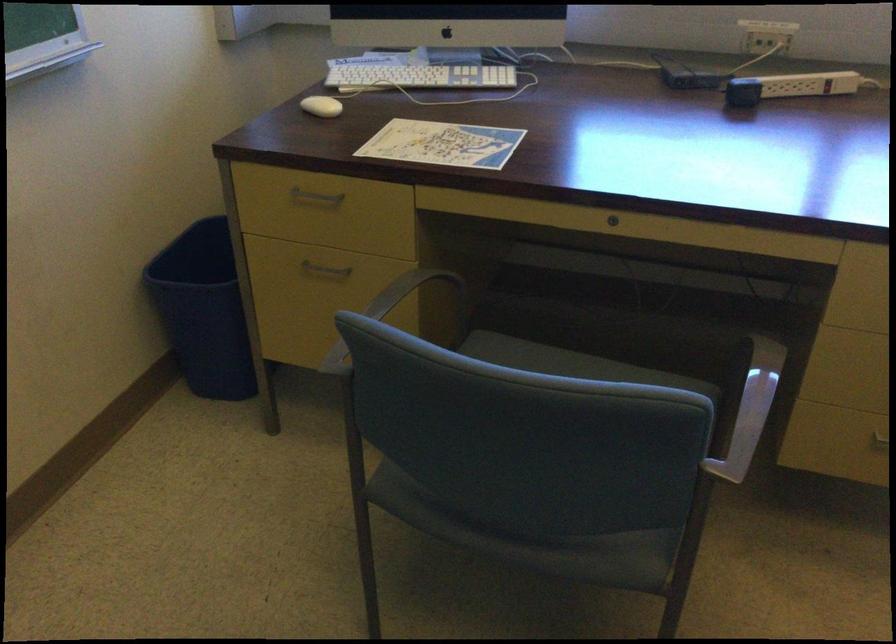
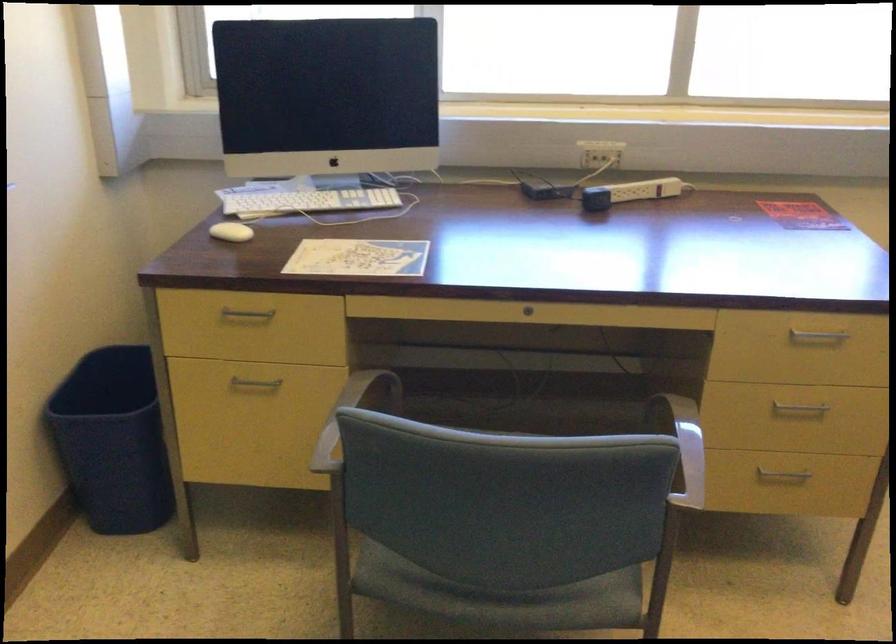
Where in the second image is the point corresponding to [802,82] from the first image?

(642, 190)